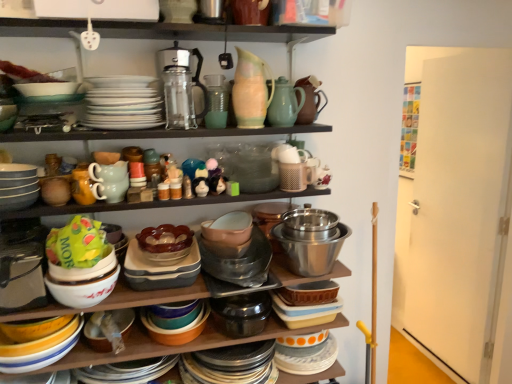
Question: Are green glass vase at upper center, which ranks as the 2th tableware in bottom-to-top order, and translucent glass cups at upper center far apart?

Choices:
 (A) yes
 (B) no

Answer: (B)

Question: Is translucent glass cups at upper center a part of green glass vase at upper center, placed as the 2th tableware when sorted from left to right?

Choices:
 (A) no
 (B) yes

Answer: (A)

Question: Is green glass vase at upper center, which ranks as the 2th tableware in bottom-to-top order, taller than translucent glass cups at upper center?

Choices:
 (A) yes
 (B) no

Answer: (A)

Question: Is green glass vase at upper center, which ranks as the 2th tableware in bottom-to-top order, in contact with translucent glass cups at upper center?

Choices:
 (A) yes
 (B) no

Answer: (B)

Question: From a real-world perspective, is green glass vase at upper center, which ranks as the 2th tableware in bottom-to-top order, over translucent glass cups at upper center?

Choices:
 (A) no
 (B) yes

Answer: (B)

Question: From the image's perspective, is green glass vase at upper center, placed as the 2th tableware when sorted from left to right, on translucent glass cups at upper center?

Choices:
 (A) yes
 (B) no

Answer: (A)

Question: Does white glossy platter at upper center, the first platter when ordered from top to bottom, have a larger size compared to matte green teapot at center-left, which ranks as the 3th tableware in top-to-bottom order?

Choices:
 (A) no
 (B) yes

Answer: (B)

Question: Is the position of white glossy platter at upper center, the first platter when ordered from top to bottom, less distant than that of matte green teapot at center-left, which ranks as the 3th tableware in top-to-bottom order?

Choices:
 (A) yes
 (B) no

Answer: (A)

Question: Can you confirm if white glossy platter at upper center, the 2th platter positioned from the bottom, is positioned to the left of matte green teapot at center-left, which is counted as the 1th tableware, starting from the bottom?

Choices:
 (A) yes
 (B) no

Answer: (B)

Question: Is white glossy platter at upper center, the 2th platter positioned from the bottom, taller than matte green teapot at center-left, which ranks as the 3th tableware in top-to-bottom order?

Choices:
 (A) yes
 (B) no

Answer: (A)

Question: Does white glossy platter at upper center, the first platter when ordered from top to bottom, come behind matte green teapot at center-left, which ranks as the 3th tableware in top-to-bottom order?

Choices:
 (A) yes
 (B) no

Answer: (B)

Question: From a real-world perspective, is white glossy platter at upper center, the 2th platter positioned from the bottom, located higher than matte green teapot at center-left, which ranks as the 3th tableware in top-to-bottom order?

Choices:
 (A) yes
 (B) no

Answer: (A)

Question: From the image's perspective, is brown matte teapot at upper center, the first tea pot positioned from the right, beneath transparent glass teapot at center, acting as the third tea pot starting from the right?

Choices:
 (A) yes
 (B) no

Answer: (B)